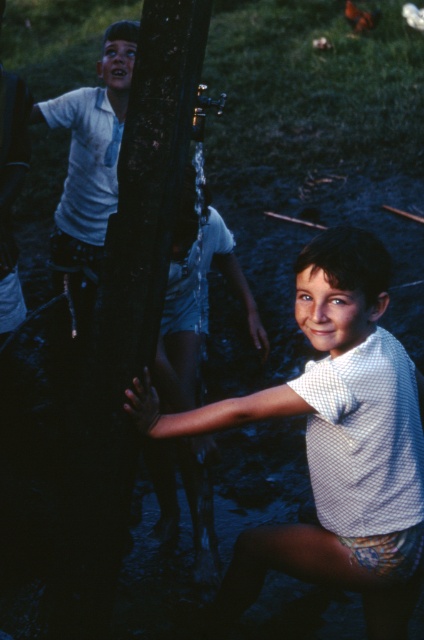
Can you confirm if white dotted shirt at center is positioned to the right of white cotton shirt at upper left?

Yes, white dotted shirt at center is to the right of white cotton shirt at upper left.

Does point (223, 627) come closer to viewer compared to point (94, 198)?

Yes.

The height and width of the screenshot is (640, 424). Identify the location of white dotted shirt at center. (314, 440).